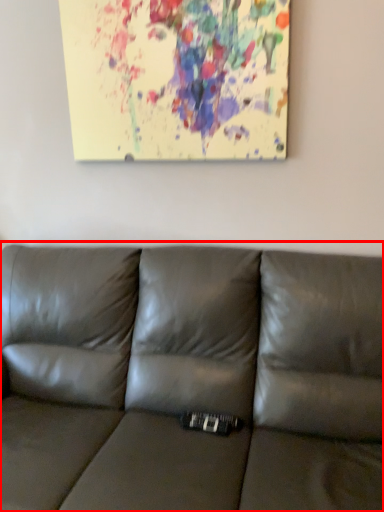
Question: From the image's perspective, what is the correct spatial relationship of studio couch (annotated by the red box) in relation to oil painting?

Choices:
 (A) above
 (B) below

Answer: (B)